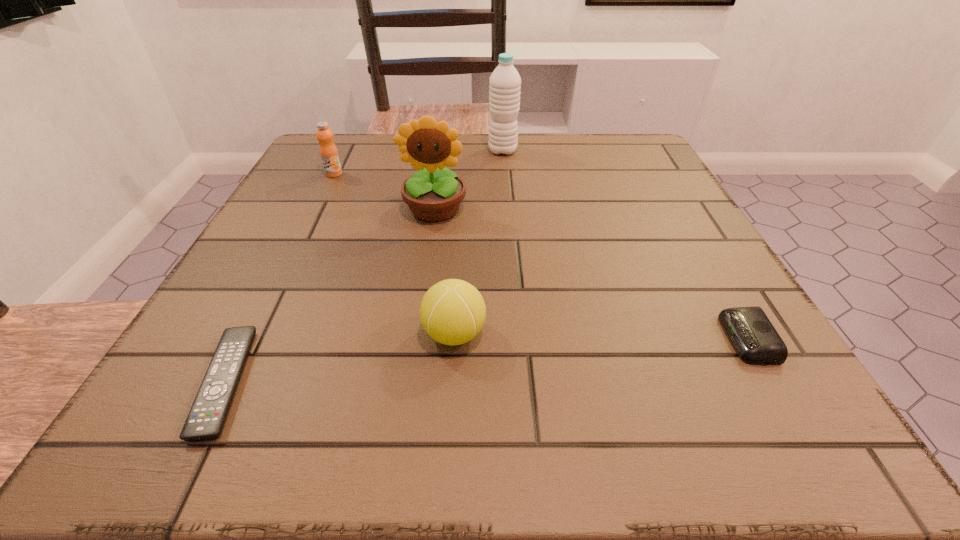
Locate an element on the screen. empty space between the rightmost object and the sunflower is located at coordinates (591, 274).

Locate an element on the screen. The width and height of the screenshot is (960, 540). free spot between the tennis ball and the second farthest object is located at coordinates (395, 254).

Locate an element on the screen. The height and width of the screenshot is (540, 960). object that is the second closest to the remote control is located at coordinates (433, 195).

Point out which object is positioned as the nearest to the orange juice. Please provide its 2D coordinates. Your answer should be formatted as a tuple, i.e. [(x, y)], where the tuple contains the x and y coordinates of a point satisfying the conditions above.

[(433, 195)]

You are a GUI agent. You are given a task and a screenshot of the screen. Output one action in this format:
    pyautogui.click(x=<x>, y=<y>)
    Task: Click on the free location that satisfies the following two spatial constraints: 1. on the front label of the tennis ball; 2. on the left side of the third tallest object
    
    Given the screenshot: What is the action you would take?
    pyautogui.click(x=255, y=334)

Locate an element on the screen. The image size is (960, 540). vacant area that satisfies the following two spatial constraints: 1. on the face of the third shortest object; 2. on the left side of the sunflower is located at coordinates (418, 334).